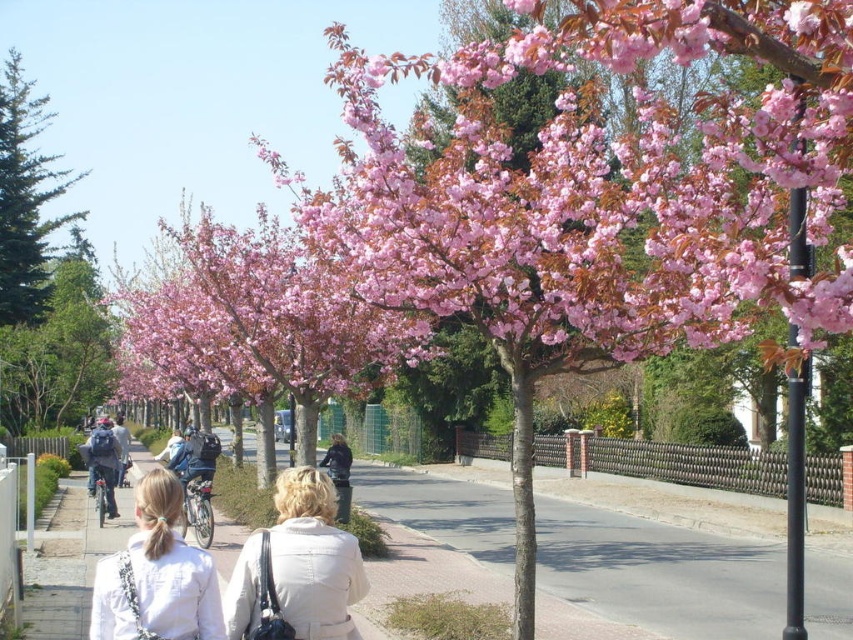
You are a photographer trying to capture the pink bloom at center and the beige fabric coat at center in the same frame. Given that your camera has a fixed focal length, which object should you focus on to ensure both are in the frame without cropping?

Since the pink bloom at center is wider than the beige fabric coat at center, you should focus on the pink bloom at center to ensure both objects fit within the frame.

You are a photographer standing in the middle of the street. You want to take a photo of the pink bloom at center and the beige fabric coat at center. Based on their positions, which object should you adjust your camera to focus on first if you want to capture both in the same frame?

The pink bloom at center is positioned on the left side of beige fabric coat at center, so you should focus on the beige fabric coat at center first to ensure both are in frame.